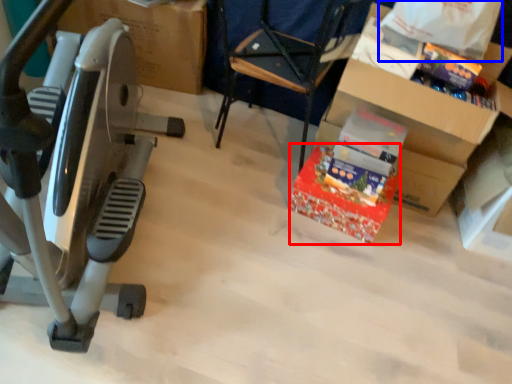
Question: Among these objects, which one is nearest to the camera, gift (highlighted by a red box) or grocery bag (highlighted by a blue box)?

Choices:
 (A) gift
 (B) grocery bag

Answer: (B)